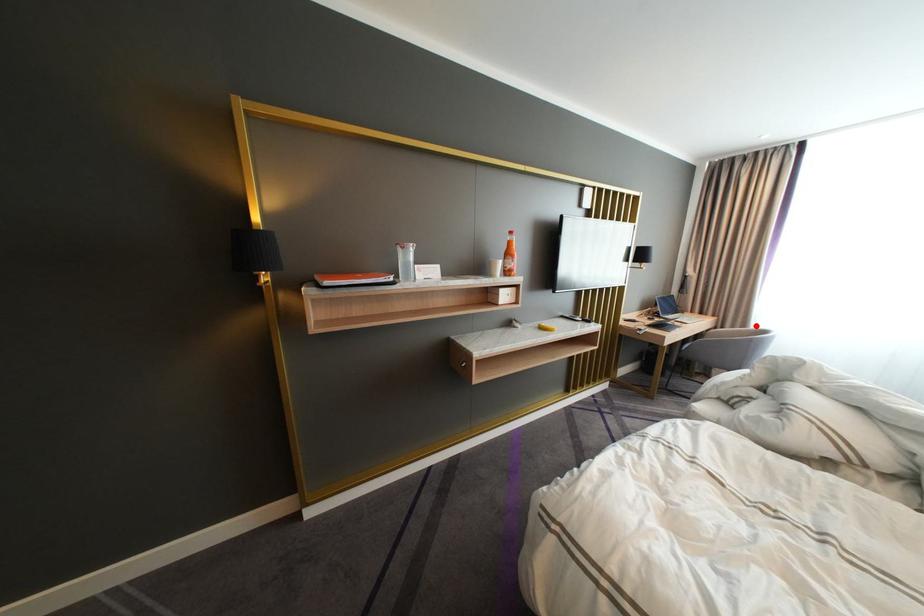
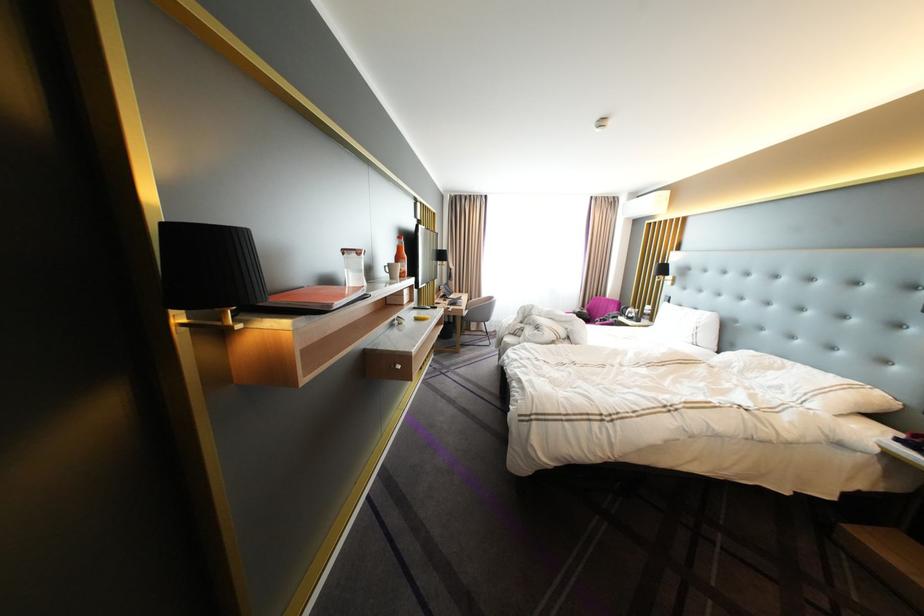
Find the pixel in the second image that matches the highlighted location in the first image.

(492, 296)